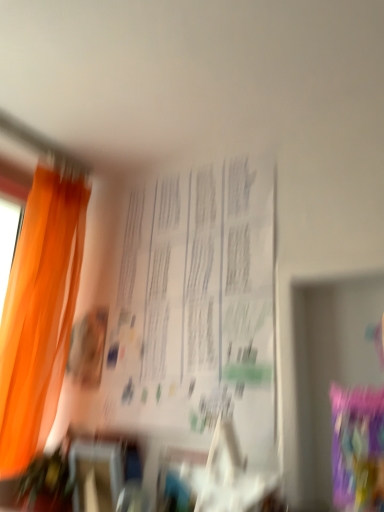
You are a GUI agent. You are given a task and a screenshot of the screen. Output one action in this format:
    pyautogui.click(x=<x>, y=<y>)
    Task: Click on the white paper at center
    
    Given the screenshot: What is the action you would take?
    pyautogui.click(x=195, y=307)

What do you see at coordinates (195, 307) in the screenshot?
I see `white paper at center` at bounding box center [195, 307].

Consider the image. What is the approximate width of white paper at center?

white paper at center is 2.13 inches wide.

The image size is (384, 512). Describe the element at coordinates (39, 315) in the screenshot. I see `orange fabric curtain at left` at that location.

In order to face orange fabric curtain at left, should I rotate leftwards or rightwards?

To align with it, rotate left about 19.981°.

Image resolution: width=384 pixels, height=512 pixels. Identify the location of orange fabric curtain at left. (39, 315).

Where is `white paper at center`? The width and height of the screenshot is (384, 512). white paper at center is located at coordinates (195, 307).

Visually, is orange fabric curtain at left positioned to the left or to the right of white paper at center?

Clearly, orange fabric curtain at left is on the left of white paper at center in the image.

Consider the image. Who is more distant, orange fabric curtain at left or white paper at center?

Positioned behind is orange fabric curtain at left.

Does point (61, 253) lie behind point (117, 329)?

Yes, point (61, 253) is farther from viewer.

From the image's perspective, is orange fabric curtain at left above or below white paper at center?

Clearly, from the image's perspective, orange fabric curtain at left is below white paper at center.

From a real-world perspective, is orange fabric curtain at left positioned over white paper at center based on gravity?

Actually, orange fabric curtain at left is physically below white paper at center in the real world.

In terms of width, does orange fabric curtain at left look wider or thinner when compared to white paper at center?

Clearly, orange fabric curtain at left has more width compared to white paper at center.

In the scene shown: Does orange fabric curtain at left have a lesser height compared to white paper at center?

Incorrect, the height of orange fabric curtain at left does not fall short of that of white paper at center.

Who is smaller, orange fabric curtain at left or white paper at center?

white paper at center.

Is orange fabric curtain at left positioned beyond the bounds of white paper at center?

orange fabric curtain at left lies outside white paper at center's area.

Would you consider orange fabric curtain at left to be distant from white paper at center?

Actually, orange fabric curtain at left and white paper at center are a little close together.

Could you tell me if orange fabric curtain at left is turned towards white paper at center?

Yes, orange fabric curtain at left is turned towards white paper at center.

How far apart are orange fabric curtain at left and white paper at center?

A distance of 16.52 inches exists between orange fabric curtain at left and white paper at center.

I want to click on curtain behind the white paper at center, so click(x=39, y=315).

Can you confirm if white paper at center is positioned to the left of orange fabric curtain at left?

In fact, white paper at center is to the right of orange fabric curtain at left.

Which object is closer to the camera taking this photo, white paper at center or orange fabric curtain at left?

white paper at center is more forward.

Which point is more distant from viewer, (251, 335) or (69, 276)?

The point (69, 276) is more distant.

From the image's perspective, is white paper at center beneath orange fabric curtain at left?

No.

From a real-world perspective, is white paper at center positioned above or below orange fabric curtain at left?

Clearly, from a real-world perspective, white paper at center is above orange fabric curtain at left.

Considering the sizes of objects white paper at center and orange fabric curtain at left in the image provided, who is thinner, white paper at center or orange fabric curtain at left?

Thinner between the two is white paper at center.

Does white paper at center have a greater height compared to orange fabric curtain at left?

No, white paper at center is not taller than orange fabric curtain at left.

Does white paper at center have a smaller size compared to orange fabric curtain at left?

Yes, white paper at center is smaller than orange fabric curtain at left.

Is white paper at center spatially inside orange fabric curtain at left, or outside of it?

white paper at center is outside orange fabric curtain at left.

Is white paper at center directly adjacent to orange fabric curtain at left?

white paper at center and orange fabric curtain at left are not in contact.

Does white paper at center turn towards orange fabric curtain at left?

No, white paper at center is not oriented towards orange fabric curtain at left.

Based on the photo, measure the distance between white paper at center and orange fabric curtain at left.

They are 16.52 inches apart.

This screenshot has height=512, width=384. I want to click on bulletin board above the orange fabric curtain at left (from the image's perspective), so click(195, 307).

This screenshot has width=384, height=512. I want to click on bulletin board that appears above the orange fabric curtain at left (from a real-world perspective), so click(x=195, y=307).

Identify the location of bulletin board in front of the orange fabric curtain at left. The height and width of the screenshot is (512, 384). (195, 307).